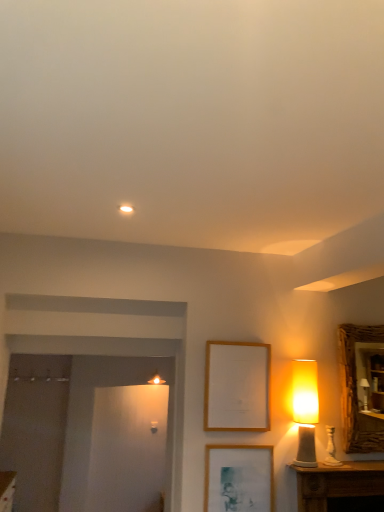
Question: Does wooden picture frame at center, which is counted as the 1th picture frame, starting from the top, come behind wooden textured mirror at right?

Choices:
 (A) yes
 (B) no

Answer: (B)

Question: Is wooden picture frame at center, which is counted as the 1th picture frame, starting from the top, at the left side of wooden textured mirror at right?

Choices:
 (A) yes
 (B) no

Answer: (A)

Question: Are wooden picture frame at center, which is counted as the 1th picture frame, starting from the top, and wooden textured mirror at right far apart?

Choices:
 (A) no
 (B) yes

Answer: (A)

Question: Is wooden picture frame at center, which appears as the second picture frame when ordered from the bottom, oriented towards wooden textured mirror at right?

Choices:
 (A) no
 (B) yes

Answer: (A)

Question: From a real-world perspective, does wooden picture frame at center, which appears as the second picture frame when ordered from the bottom, sit lower than wooden textured mirror at right?

Choices:
 (A) yes
 (B) no

Answer: (A)

Question: Is wooden picture frame at center, which is counted as the 1th picture frame, starting from the top, outside wooden textured mirror at right?

Choices:
 (A) no
 (B) yes

Answer: (B)

Question: Is matte yellow lampshade at right turned away from wooden picture frame at center, which appears as the second picture frame when ordered from the bottom?

Choices:
 (A) yes
 (B) no

Answer: (B)

Question: Is matte yellow lampshade at right positioned in front of wooden picture frame at center, which appears as the second picture frame when ordered from the bottom?

Choices:
 (A) yes
 (B) no

Answer: (A)

Question: Is matte yellow lampshade at right further to camera compared to wooden picture frame at center, which appears as the second picture frame when ordered from the bottom?

Choices:
 (A) no
 (B) yes

Answer: (A)

Question: From a real-world perspective, is matte yellow lampshade at right below wooden picture frame at center, which is counted as the 1th picture frame, starting from the top?

Choices:
 (A) no
 (B) yes

Answer: (B)

Question: Is matte yellow lampshade at right wider than wooden picture frame at center, which is counted as the 1th picture frame, starting from the top?

Choices:
 (A) yes
 (B) no

Answer: (A)

Question: Can you confirm if matte yellow lampshade at right is shorter than wooden picture frame at center, which is counted as the 1th picture frame, starting from the top?

Choices:
 (A) no
 (B) yes

Answer: (A)

Question: Is matte yellow lampshade at right wider than wooden textured mirror at right?

Choices:
 (A) no
 (B) yes

Answer: (B)